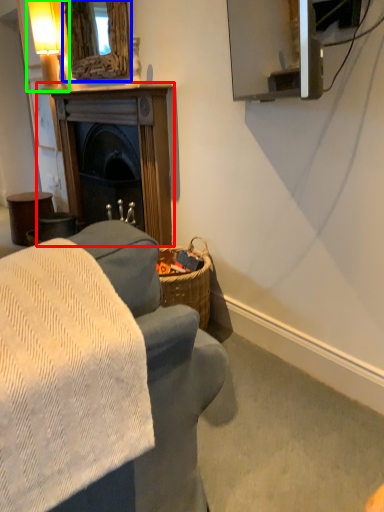
Question: Which object is positioned farthest from fireplace (highlighted by a red box)? Select from mirror (highlighted by a blue box) and table lamp (highlighted by a green box).

Choices:
 (A) mirror
 (B) table lamp

Answer: (B)